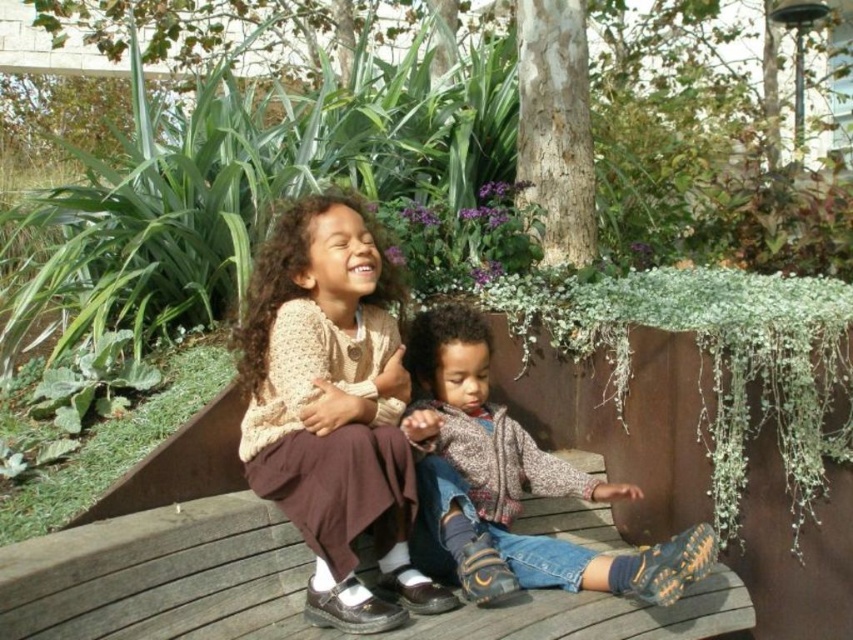
Between knitted beige sweater at center and knitted sweater at center, which one is positioned higher?

knitted beige sweater at center is higher up.

Between knitted beige sweater at center and knitted sweater at center, which one has more height?

Standing taller between the two is knitted beige sweater at center.

The width and height of the screenshot is (853, 640). What do you see at coordinates (332, 408) in the screenshot?
I see `knitted beige sweater at center` at bounding box center [332, 408].

Image resolution: width=853 pixels, height=640 pixels. What are the coordinates of `knitted beige sweater at center` in the screenshot? It's located at (332, 408).